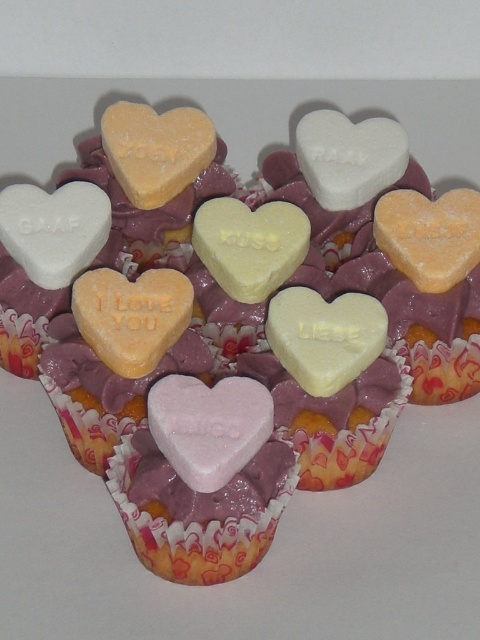
Is pink matte heart at center bigger than white matte heart at center?

Incorrect, pink matte heart at center is not larger than white matte heart at center.

How distant is pink matte heart at center from white matte heart at center?

pink matte heart at center is 16.44 inches away from white matte heart at center.

Identify the location of pink matte heart at center. (208, 426).

Does pink matte heart at center come behind white matte heart at upper left?

No.

Who is more distant from viewer, (242, 401) or (36, 243)?

The point (36, 243) is behind.

This screenshot has width=480, height=640. Find the location of `pink matte heart at center`. pink matte heart at center is located at coordinates (208, 426).

Is point (14, 225) positioned in front of point (372, 131)?

Yes, point (14, 225) is closer to viewer.

Describe the element at coordinates (54, 228) in the screenshot. I see `white matte heart at upper left` at that location.

Image resolution: width=480 pixels, height=640 pixels. I want to click on white matte heart at upper left, so click(54, 228).

Locate an element on the screen. The image size is (480, 640). white matte heart at upper left is located at coordinates (54, 228).